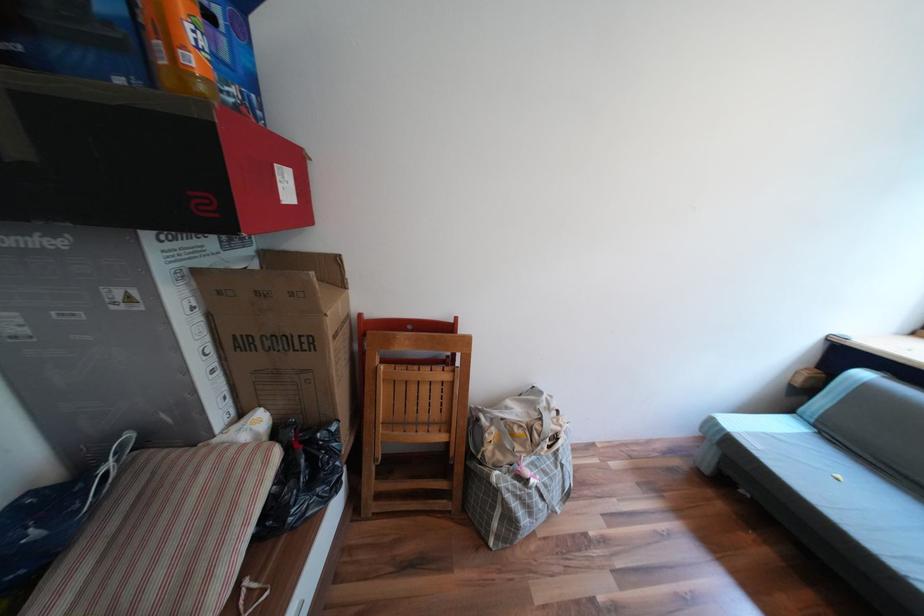
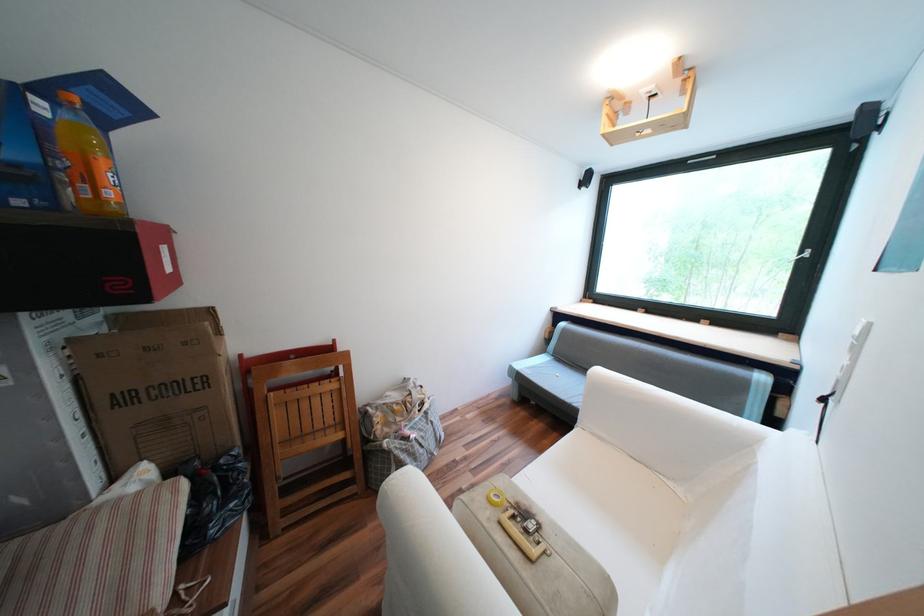
Find the pixel in the second image that matches point (721, 422) in the first image.

(520, 369)